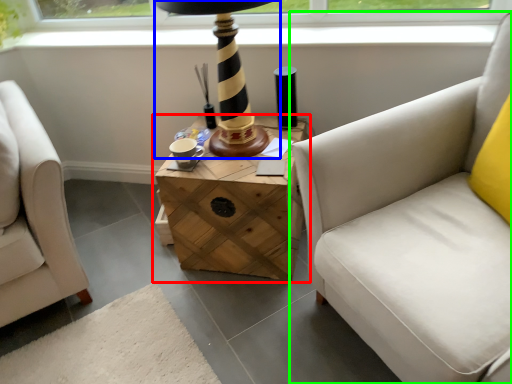
Question: Which object is the farthest from table (highlighted by a red box)? Choose among these: table lamp (highlighted by a blue box) or studio couch (highlighted by a green box).

Choices:
 (A) table lamp
 (B) studio couch

Answer: (B)